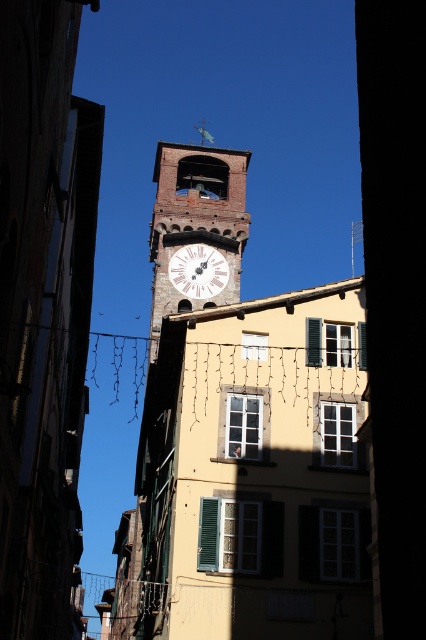
You are a tourist visiting the historic town square and want to take a photo of both the white painted stone clock tower at center and the white wooden clock at center. Which one should you focus on first to ensure both are in the frame?

You should focus on the white painted stone clock tower at center first because it is larger in size than the white wooden clock at center, so it will take up more space in the photo and ensure both are visible.

You are a tourist standing in the town square facing the historic buildings. You see the white painted stone clock tower at center and the white wooden clock at center. Which of these two objects is positioned to the left of the other?

The white painted stone clock tower at center is to the left of the white wooden clock at center.